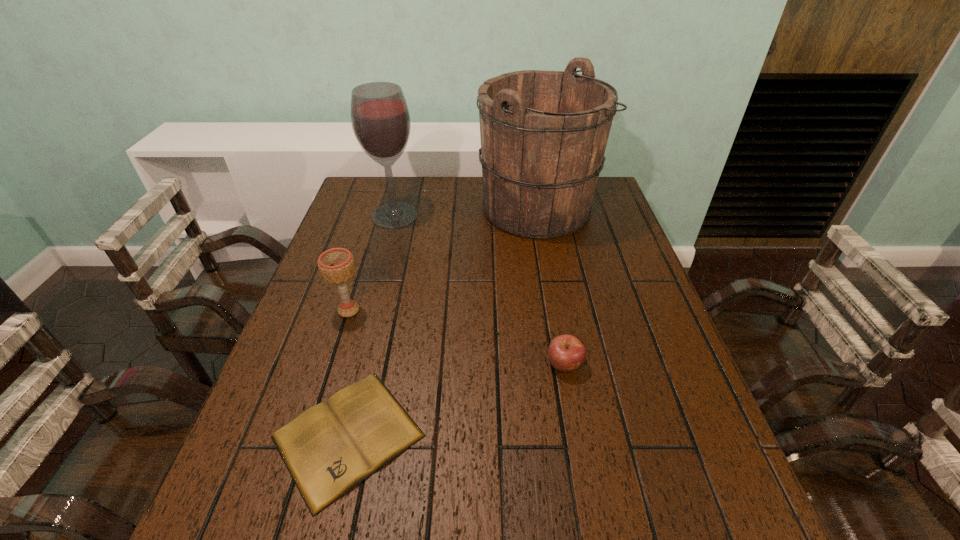
Identify the location of object positioned at the far right corner. (543, 134).

Locate an element on the screen. The width and height of the screenshot is (960, 540). free space at the far edge of the desktop is located at coordinates (444, 211).

This screenshot has width=960, height=540. In order to click on vacant space at the near edge in this screenshot , I will do [x=460, y=518].

This screenshot has width=960, height=540. What are the coordinates of `blank area at the left edge` in the screenshot? It's located at (359, 316).

Find the location of `empty space between the bucket and the alcohol`. empty space between the bucket and the alcohol is located at coordinates (466, 212).

You are a GUI agent. You are given a task and a screenshot of the screen. Output one action in this format:
    pyautogui.click(x=<x>, y=<y>)
    Task: Click on the free space between the bucket and the book
    The height and width of the screenshot is (540, 960).
    Given the screenshot: What is the action you would take?
    pyautogui.click(x=443, y=322)

Identify the location of vacant space in between the third farthest object and the shortest object. This screenshot has height=540, width=960. [x=348, y=373].

The height and width of the screenshot is (540, 960). I want to click on vacant area that lies between the alcohol and the bucket, so click(x=466, y=212).

The width and height of the screenshot is (960, 540). Identify the location of free space between the third shortest object and the bucket. (443, 259).

Find the location of a particular element. This screenshot has height=540, width=960. empty location between the chalice and the alcohol is located at coordinates (372, 263).